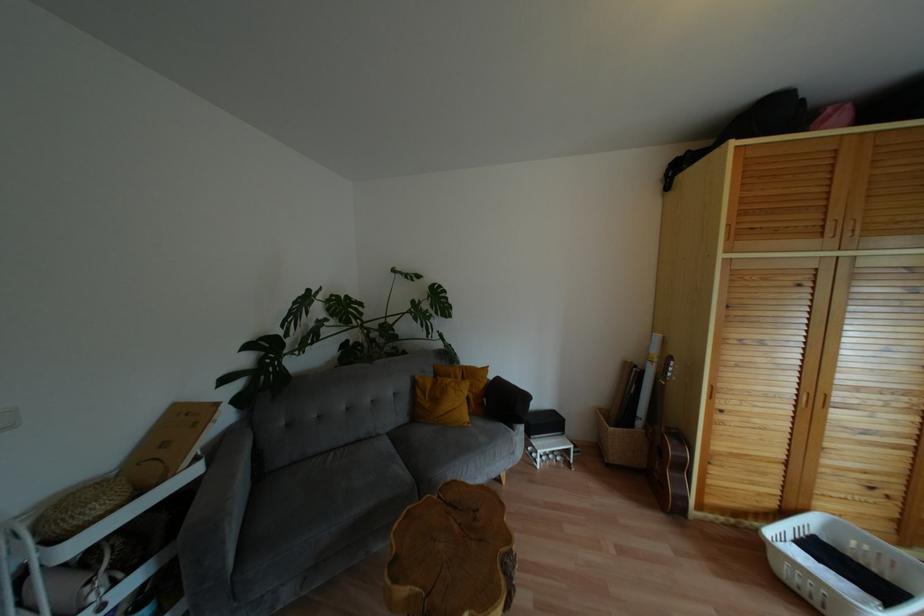
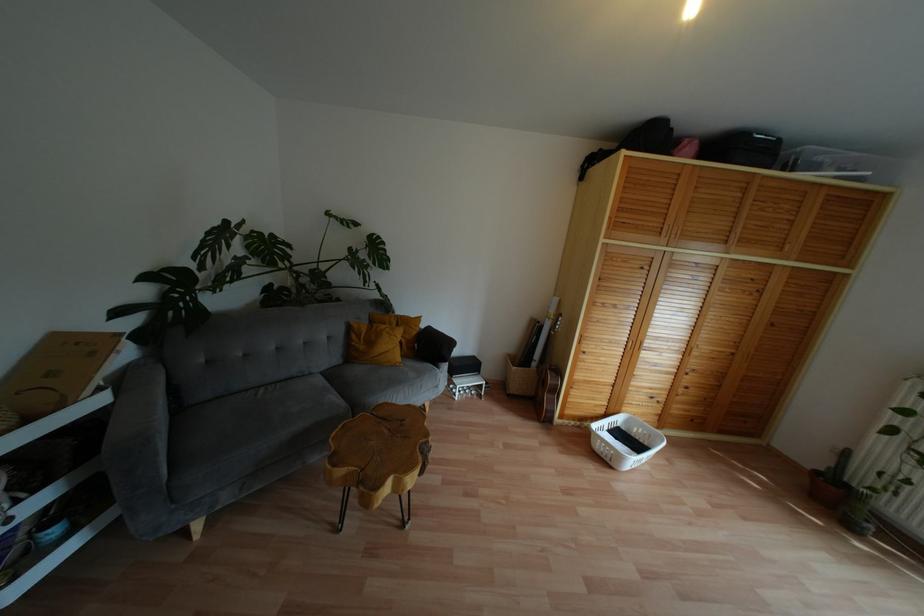
Question: How did the camera likely rotate?

Choices:
 (A) Left
 (B) Right
 (C) Up
 (D) Down

Answer: (B)